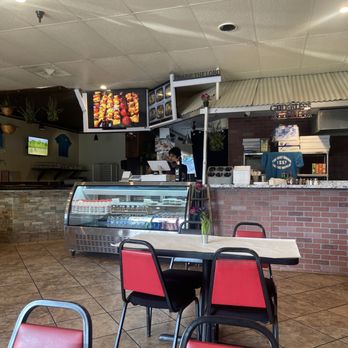
Image resolution: width=348 pixels, height=348 pixels. Identify the location of brick counter. (298, 220).